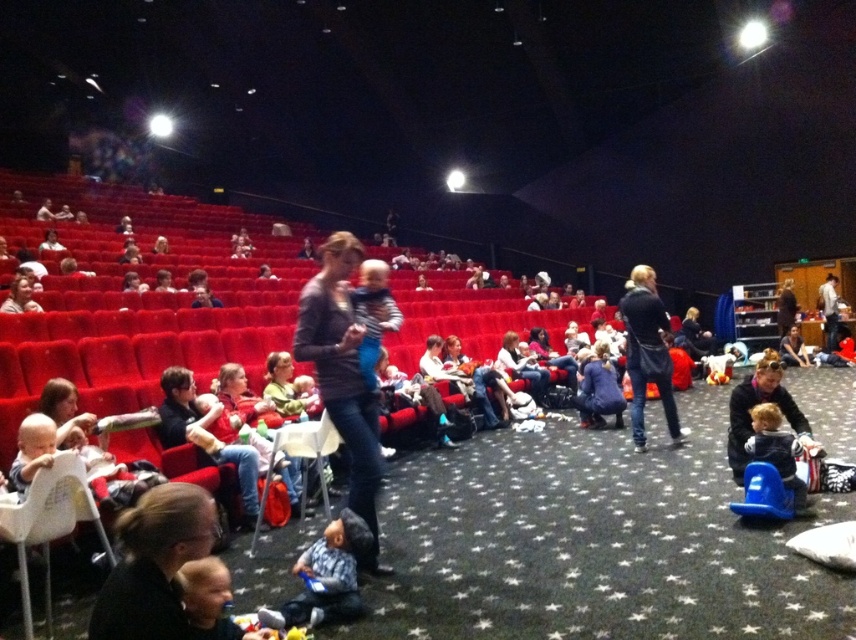
Question: Which point is farther to the camera?

Choices:
 (A) matte gray sweater at center
 (B) matte black jacket at upper left

Answer: (B)

Question: Is dark blue jacket at center closer to camera compared to light brown plush toy at lower right?

Choices:
 (A) no
 (B) yes

Answer: (A)

Question: Which of the following is the farthest from the observer?

Choices:
 (A) (782, 452)
 (B) (34, 305)
 (C) (153, 561)

Answer: (B)

Question: Does dark brown leather jacket at lower left have a greater width compared to matte black jacket at upper left?

Choices:
 (A) yes
 (B) no

Answer: (B)

Question: Does light brown plush toy at lower right have a lesser width compared to matte black jacket at upper left?

Choices:
 (A) no
 (B) yes

Answer: (A)

Question: Which point is closer to the camera?

Choices:
 (A) (795, 476)
 (B) (354, 401)
 (C) (649, 312)
 (D) (168, 566)

Answer: (D)